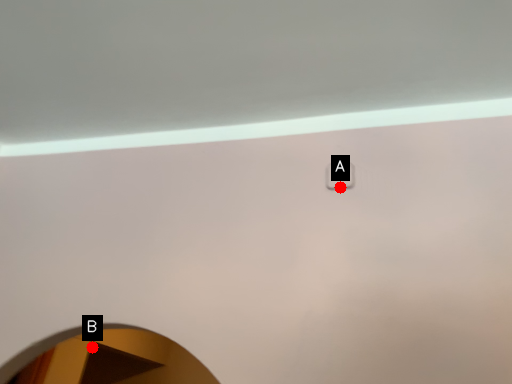
Question: Two points are circled on the image, labeled by A and B beside each circle. Among these points, which one is nearest to the camera?

Choices:
 (A) A is closer
 (B) B is closer

Answer: (A)